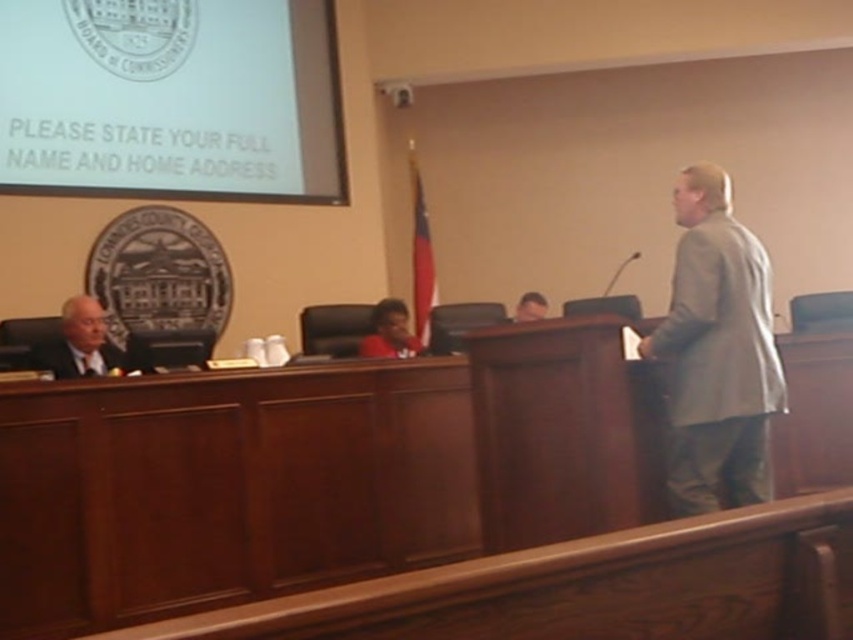
Between point (677, 342) and point (42, 342), which one is positioned in front?

Point (677, 342) is in front.

This screenshot has height=640, width=853. Describe the element at coordinates (717, 353) in the screenshot. I see `gray fabric suit at right` at that location.

Locate an element on the screen. gray fabric suit at right is located at coordinates (717, 353).

Can you confirm if dark gray fabric business suit at left is smaller than smooth gray suit at center?

No.

Looking at this image, which is more to the left, dark gray fabric business suit at left or smooth gray suit at center?

dark gray fabric business suit at left

Which is behind, point (114, 358) or point (531, 316)?

The point (531, 316) is more distant.

At what (x,y) coordinates should I click in order to perform the action: click on dark gray fabric business suit at left. Please return your answer as a coordinate pair (x, y). This screenshot has width=853, height=640. Looking at the image, I should click on (76, 358).

Is gray suit at left to the left of smooth gray suit at center from the viewer's perspective?

Correct, you'll find gray suit at left to the left of smooth gray suit at center.

Find the location of `gray suit at left`. gray suit at left is located at coordinates (80, 342).